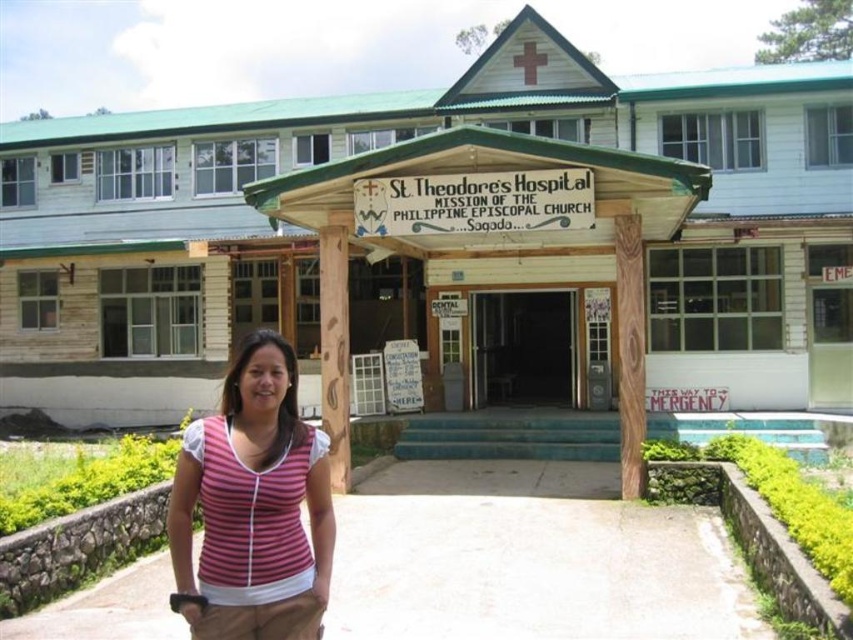
Question: Does pink striped shirt at lower left come behind wooden column at center?

Choices:
 (A) no
 (B) yes

Answer: (A)

Question: Is pink striped shirt at lower left positioned behind wooden column at center?

Choices:
 (A) no
 (B) yes

Answer: (A)

Question: Which object appears farthest from the camera in this image?

Choices:
 (A) wooden column at center
 (B) pink striped shirt at lower left

Answer: (A)

Question: Is pink striped shirt at lower left closer to camera compared to wooden column at center?

Choices:
 (A) yes
 (B) no

Answer: (A)

Question: Which point is farther from the camera taking this photo?

Choices:
 (A) click(347, 385)
 (B) click(259, 346)

Answer: (A)